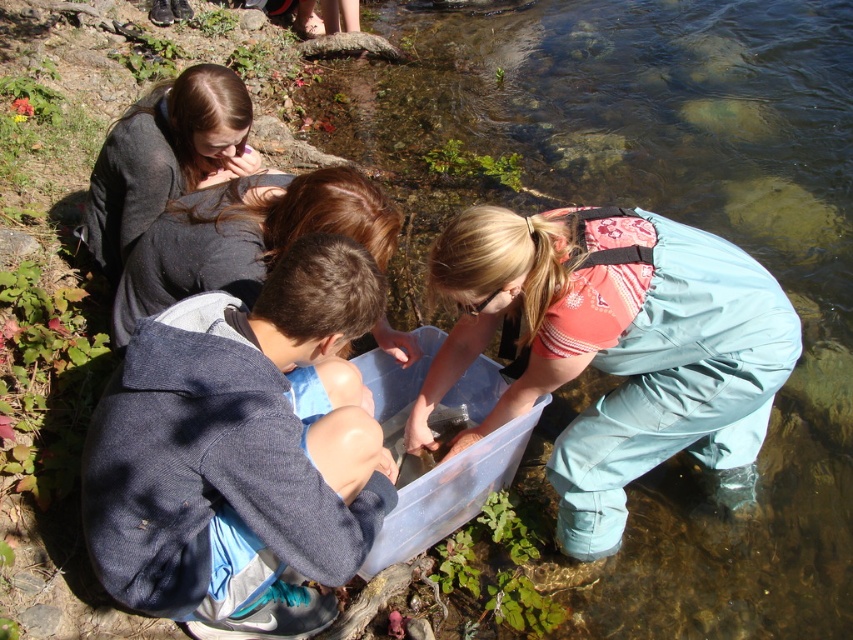
Looking at this image, you are a photographer trying to capture the scene of the group around the container. You want to ensure the matte gray hoodie at upper left is in the frame. Based on its coordinates, where should you position your camera to include it?

The matte gray hoodie at upper left is located at coordinates point (x=245, y=236), so positioning the camera to include this point will ensure the hoodie is in the frame.

You are a photographer wanting to capture a closeup of the blue fleece jacket at lower left and the dark gray fabric at upper left. Which object should you zoom in on first if you want to focus on the wider one?

The dark gray fabric at upper left is wider than the blue fleece jacket at lower left, so you should zoom in on the dark gray fabric at upper left first.

In the scene shown: You are a photographer trying to capture a clear shot of the container being examined by the group. You notice two people wearing the blue fleece jacket at lower left and the matte gray hoodie at upper left. Based on their positions, which person is standing closer to the camera?

The blue fleece jacket at lower left has a greater height compared to the matte gray hoodie at upper left, so the blue fleece jacket at lower left is closer to the camera since objects closer to the camera appear larger in the image.